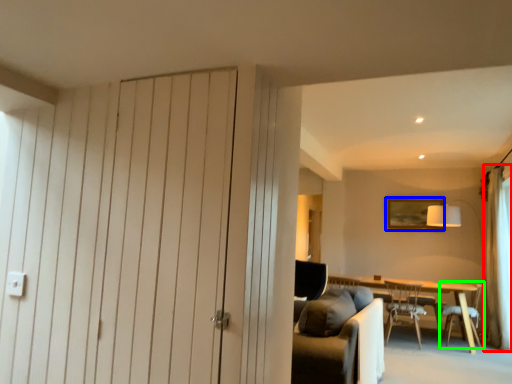
Question: Which is farther away from curtain (highlighted by a red box)? picture frame (highlighted by a blue box) or chair (highlighted by a green box)?

Choices:
 (A) picture frame
 (B) chair

Answer: (A)